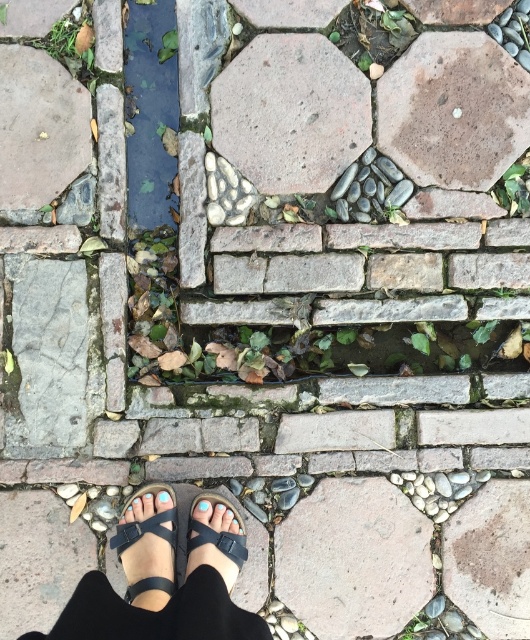
Between black leather sandals at center and black matte sandal at lower center, which one is positioned lower?

black leather sandals at center is below.

Does point (94, 602) lie behind point (198, 515)?

That is False.

Find the location of a particular element. This screenshot has width=530, height=640. black leather sandals at center is located at coordinates (164, 579).

Which is in front, point (69, 611) or point (390, 144)?

Positioned in front is point (69, 611).

The width and height of the screenshot is (530, 640). What are the coordinates of `black leather sandals at center` in the screenshot? It's located at (164, 579).

You are a GUI agent. You are given a task and a screenshot of the screen. Output one action in this format:
    pyautogui.click(x=<x>, y=<y>)
    Task: Click on the black leather sandals at center
    This screenshot has height=640, width=530.
    Given the screenshot: What is the action you would take?
    pyautogui.click(x=164, y=579)

Where is `black leather sandal at lower left`? This screenshot has width=530, height=640. black leather sandal at lower left is located at coordinates (146, 548).

Does black leather sandal at lower left have a smaller size compared to black matte sandal at lower center?

No.

This screenshot has height=640, width=530. What do you see at coordinates (146, 548) in the screenshot?
I see `black leather sandal at lower left` at bounding box center [146, 548].

What are the coordinates of `black leather sandal at lower left` in the screenshot? It's located at (146, 548).